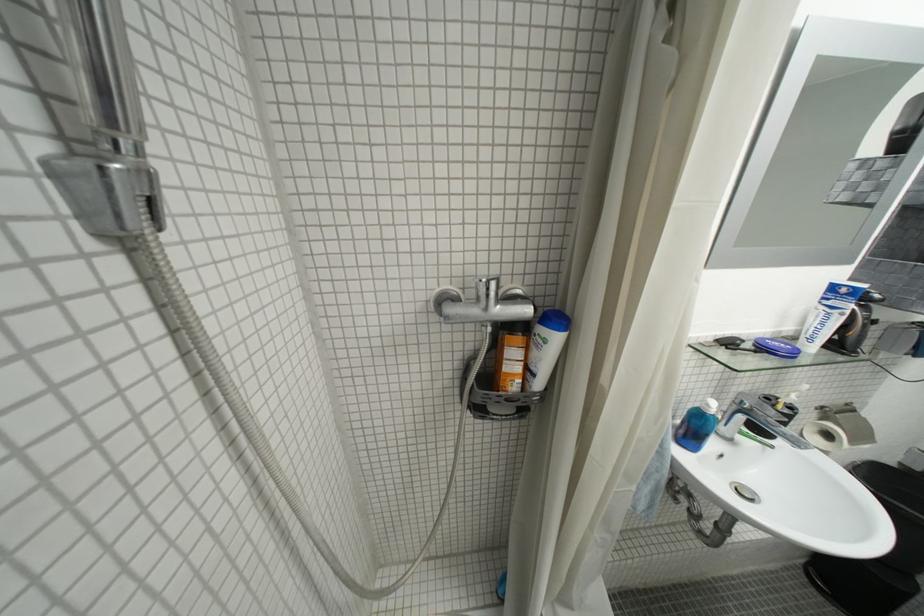
Locate an element on the screen. This screenshot has width=924, height=616. white toilet paper roll is located at coordinates (824, 436).